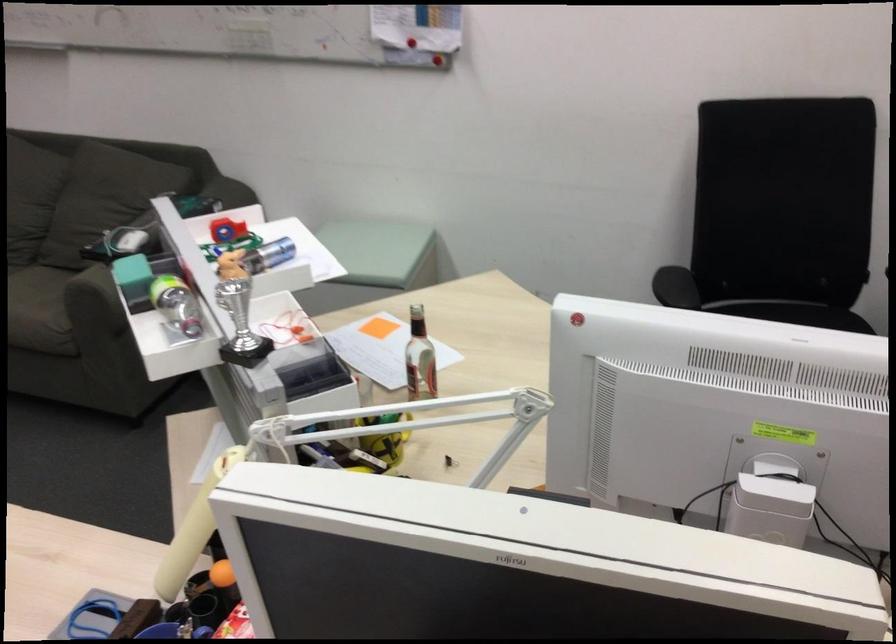
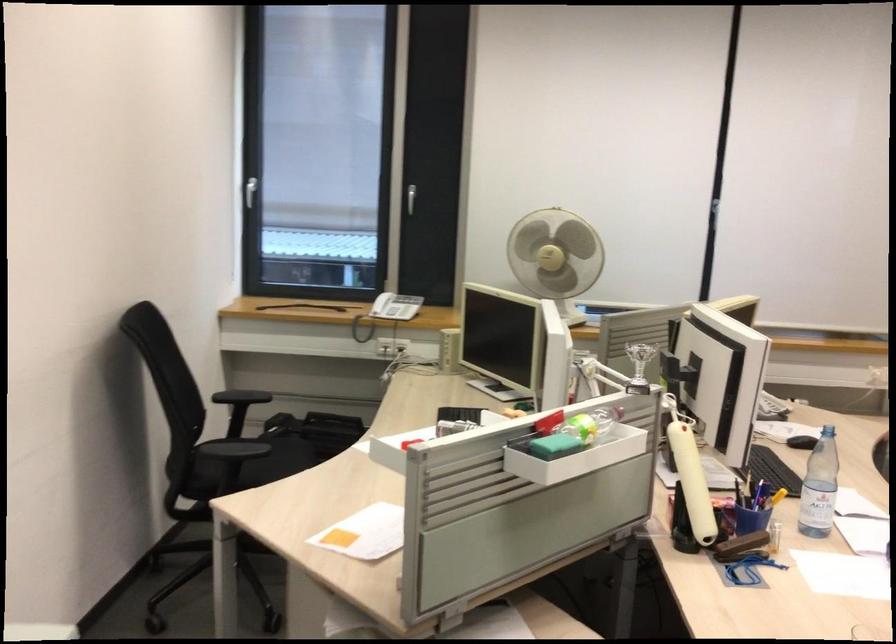
Question: I am providing you with two images of the same scene from different viewpoints. After the viewpoint changes to image2, which objects are now occluded?

Choices:
 (A) yellow smart phone
 (B) green sponge
 (C) small silver trophy
 (D) white power adapter

Answer: (D)